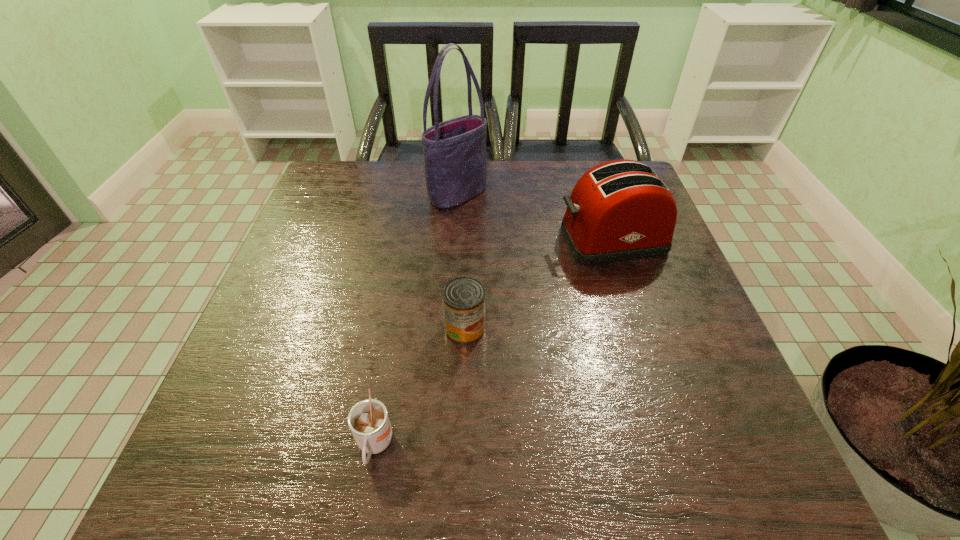
At what (x,y) coordinates should I click in order to perform the action: click on free region that satisfies the following two spatial constraints: 1. on the front side of the second nearest object; 2. on the left side of the tallest object. Please return your answer as a coordinate pair (x, y). Image resolution: width=960 pixels, height=540 pixels. Looking at the image, I should click on (449, 328).